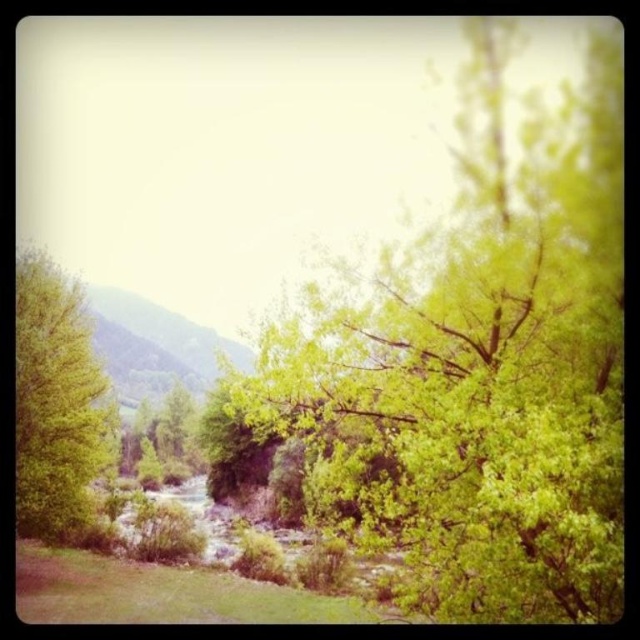
Question: From the image, what is the correct spatial relationship of green leafy tree at center in relation to green leafy tree at left?

Choices:
 (A) above
 (B) below

Answer: (A)

Question: Can you confirm if green leafy tree at center is positioned to the left of green leafy tree at left?

Choices:
 (A) no
 (B) yes

Answer: (A)

Question: Which of the following is the farthest from the observer?

Choices:
 (A) green leafy tree at left
 (B) green leafy tree at center

Answer: (A)

Question: Which point is closer to the camera taking this photo?

Choices:
 (A) (48, 264)
 (B) (452, 294)

Answer: (B)

Question: In this image, where is green leafy tree at center located relative to green leafy tree at left?

Choices:
 (A) below
 (B) above

Answer: (B)